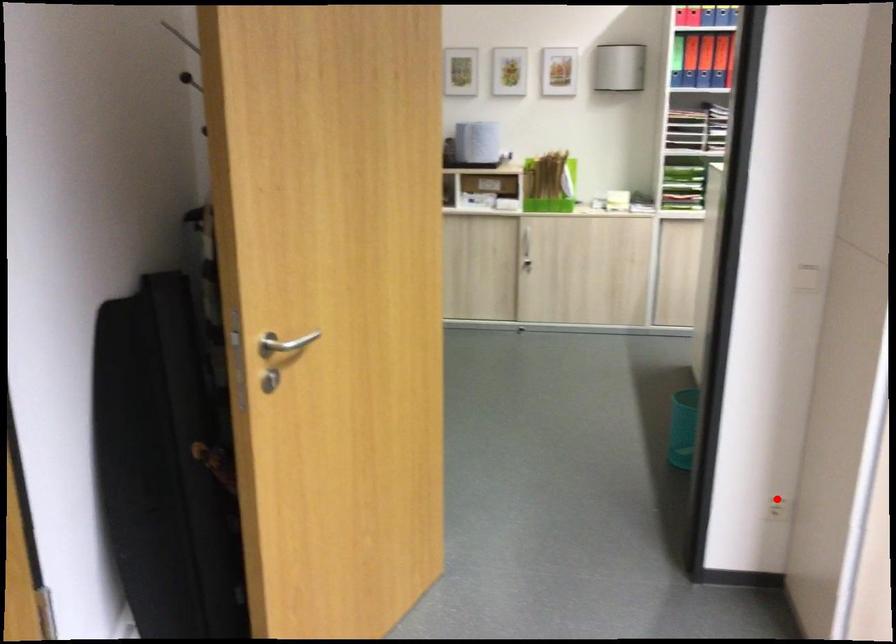
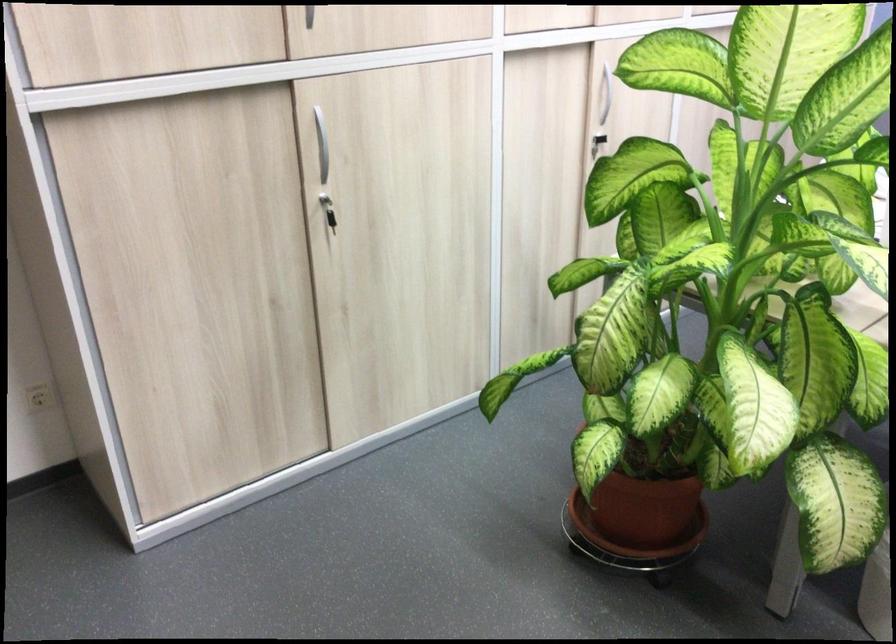
Locate, in the second image, the point that corresponds to the highlighted location in the first image.

(39, 397)